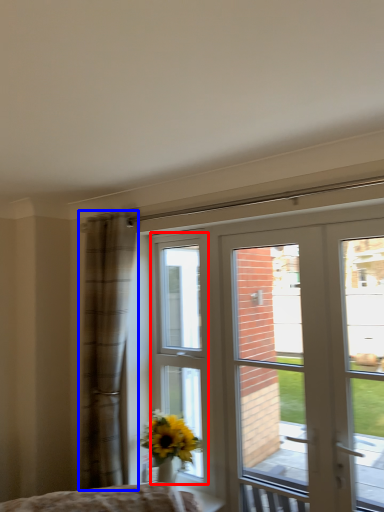
Question: Which object appears closest to the camera in this image, bay window (highlighted by a red box) or curtain (highlighted by a blue box)?

Choices:
 (A) bay window
 (B) curtain

Answer: (B)